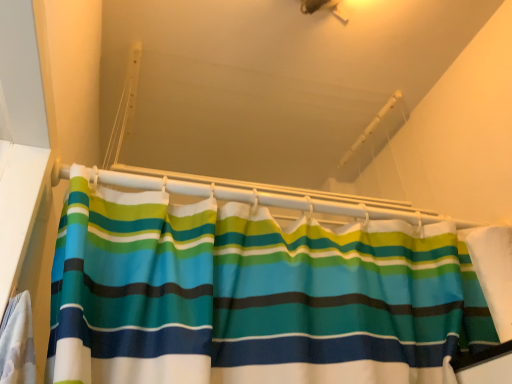
What do you see at coordinates (494, 273) in the screenshot?
I see `white fabric at right` at bounding box center [494, 273].

Where is `white fabric at right`? white fabric at right is located at coordinates (494, 273).

In order to face white fabric at right, should I rotate leftwards or rightwards?

You should look right and rotate roughly 30.072 degrees.

The image size is (512, 384). Identify the location of white plastic shower curtain rod at upper center. (268, 195).

The image size is (512, 384). Describe the element at coordinates (268, 195) in the screenshot. I see `white plastic shower curtain rod at upper center` at that location.

Consider the image. Measure the distance between white plastic shower curtain rod at upper center and camera.

white plastic shower curtain rod at upper center and camera are 29.87 inches apart from each other.

The height and width of the screenshot is (384, 512). What are the coordinates of `white fabric at right` in the screenshot? It's located at (494, 273).

Based on their positions, is white plastic shower curtain rod at upper center located to the left or right of white fabric at right?

Based on their positions, white plastic shower curtain rod at upper center is located to the left of white fabric at right.

In the scene shown: Is white plastic shower curtain rod at upper center positioned before white fabric at right?

No, it is not.

Between point (371, 202) and point (483, 238), which one is positioned in front?

The point (483, 238) is closer.

From the image's perspective, does white plastic shower curtain rod at upper center appear lower than white fabric at right?

No, from the image's perspective, white plastic shower curtain rod at upper center is not beneath white fabric at right.

From a real-world perspective, which is physically below, white plastic shower curtain rod at upper center or white fabric at right?

white fabric at right, from a real-world perspective.

Considering the sizes of white plastic shower curtain rod at upper center and white fabric at right in the image, is white plastic shower curtain rod at upper center wider or thinner than white fabric at right?

white plastic shower curtain rod at upper center is thinner than white fabric at right.

Looking at this image, is white plastic shower curtain rod at upper center shorter than white fabric at right?

Yes.

Considering the sizes of objects white plastic shower curtain rod at upper center and white fabric at right in the image provided, who is bigger, white plastic shower curtain rod at upper center or white fabric at right?

With larger size is white fabric at right.

Is white plastic shower curtain rod at upper center outside of white fabric at right?

white plastic shower curtain rod at upper center lies outside white fabric at right's area.

Are white plastic shower curtain rod at upper center and white fabric at right located far from each other?

No, white plastic shower curtain rod at upper center is not far from white fabric at right.

Is white plastic shower curtain rod at upper center oriented towards white fabric at right?

No.

What's the angular difference between white plastic shower curtain rod at upper center and white fabric at right's facing directions?

white plastic shower curtain rod at upper center and white fabric at right are facing 90.3 degrees away from each other.

How far apart are white plastic shower curtain rod at upper center and white fabric at right?

The distance of white plastic shower curtain rod at upper center from white fabric at right is 35.45 centimeters.

Locate an element on the screen. The width and height of the screenshot is (512, 384). balustrade on the left of white fabric at right is located at coordinates (268, 195).

Can you confirm if white fabric at right is positioned to the right of white plastic shower curtain rod at upper center?

Yes, white fabric at right is to the right of white plastic shower curtain rod at upper center.

Which is in front, white fabric at right or white plastic shower curtain rod at upper center?

white fabric at right is in front.

Which point is more forward, (480, 246) or (62, 176)?

Positioned in front is point (480, 246).

From the image's perspective, which object appears higher, white fabric at right or white plastic shower curtain rod at upper center?

From the image's view, white plastic shower curtain rod at upper center is above.

From a real-world perspective, is white fabric at right physically located above or below white plastic shower curtain rod at upper center?

Clearly, from a real-world perspective, white fabric at right is below white plastic shower curtain rod at upper center.

Between white fabric at right and white plastic shower curtain rod at upper center, which one has larger width?

white fabric at right.

In terms of height, does white fabric at right look taller or shorter compared to white plastic shower curtain rod at upper center?

Clearly, white fabric at right is taller compared to white plastic shower curtain rod at upper center.

Can you confirm if white fabric at right is bigger than white plastic shower curtain rod at upper center?

Indeed, white fabric at right has a larger size compared to white plastic shower curtain rod at upper center.

Is white fabric at right not within white plastic shower curtain rod at upper center?

Yes.

Is white fabric at right not near white plastic shower curtain rod at upper center?

No, white fabric at right is in close proximity to white plastic shower curtain rod at upper center.

Is white fabric at right looking in the opposite direction of white plastic shower curtain rod at upper center?

No, white plastic shower curtain rod at upper center is not at the back of white fabric at right.

What's the angular difference between white fabric at right and white plastic shower curtain rod at upper center's facing directions?

The angular difference between white fabric at right and white plastic shower curtain rod at upper center is 90.3 degrees.

How distant is white fabric at right from white plastic shower curtain rod at upper center?

13.96 inches.

You are a GUI agent. You are given a task and a screenshot of the screen. Output one action in this format:
    pyautogui.click(x=<x>, y=<y>)
    Task: Click on the balustrade lying above the white fabric at right (from the image's perspective)
    
    Given the screenshot: What is the action you would take?
    pyautogui.click(x=268, y=195)

This screenshot has width=512, height=384. Find the location of `balustrade located above the white fabric at right (from a real-world perspective)`. balustrade located above the white fabric at right (from a real-world perspective) is located at coordinates (268, 195).

Find the location of a particular element. This screenshot has height=384, width=512. balustrade that is on the left side of white fabric at right is located at coordinates (268, 195).